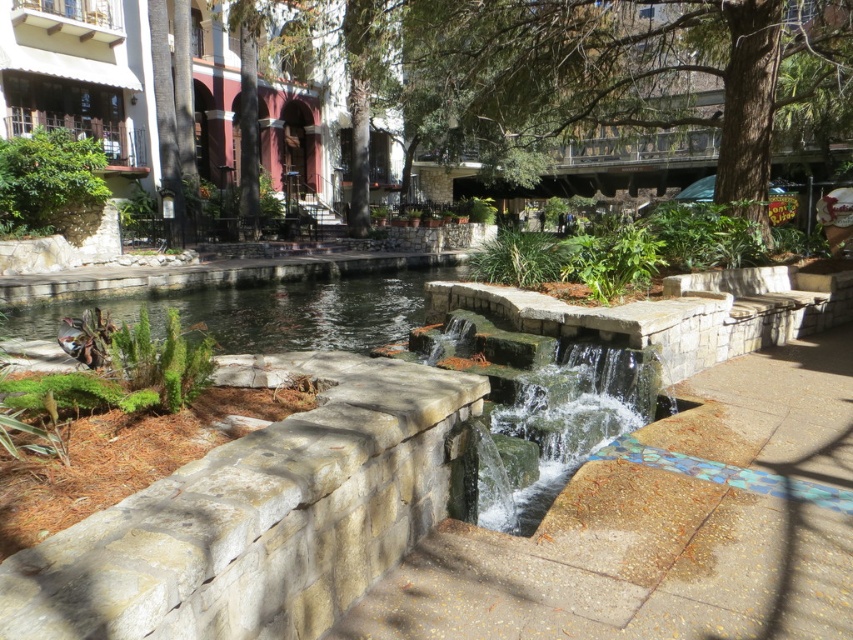
Between smooth concrete steps at center and green leafy tree at upper center, which one has more height?

green leafy tree at upper center

Who is more distant from viewer, (730, 449) or (753, 156)?

Point (753, 156)

Is point (842, 404) less distant than point (531, 10)?

Yes, point (842, 404) is closer to viewer.

The width and height of the screenshot is (853, 640). In order to click on smooth concrete steps at center in this screenshot , I will do `click(625, 566)`.

Which of these two, green leafy tree at upper center or clear water at center, stands taller?

green leafy tree at upper center

Can you confirm if green leafy tree at upper center is positioned below clear water at center?

Incorrect, green leafy tree at upper center is not positioned below clear water at center.

Find the location of a particular element. This screenshot has height=640, width=853. green leafy tree at upper center is located at coordinates (621, 72).

Is smooth concrete steps at center positioned behind green mossy stone waterfall at center?

No, it is not.

Is smooth concrete steps at center thinner than green mossy stone waterfall at center?

In fact, smooth concrete steps at center might be wider than green mossy stone waterfall at center.

Is point (387, 579) positioned in front of point (582, 397)?

Yes, point (387, 579) is closer to viewer.

Identify the location of smooth concrete steps at center. (625, 566).